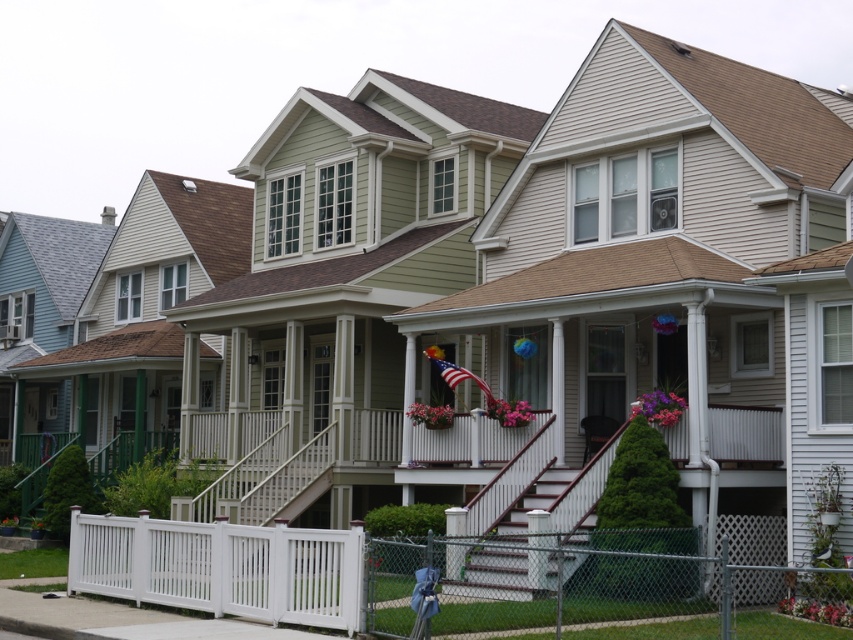
You are a delivery person trying to navigate through the suburban neighborhood. You need to pass between the white vinyl fence at lower left and the white wooden stairs at center. Which one should you avoid bumping into if you want to keep your delivery cart narrow?

The white vinyl fence at lower left might be wider than white wooden stairs at center, so you should avoid bumping into the white wooden stairs at center since it is narrower and poses a higher risk of collision for the delivery cart.

You are planning to move a 6.5 feet wide garden bench from the driveway to the area near the white wooden stairs at center. There is a white vinyl fence at lower left in the way. Can you move the bench without tilting it sideways?

Answer: The distance between the white vinyl fence at lower left and white wooden stairs at center is 6.60 feet. Since the bench is 6.5 feet wide, it can fit through the space as the distance is slightly wider than the bench.